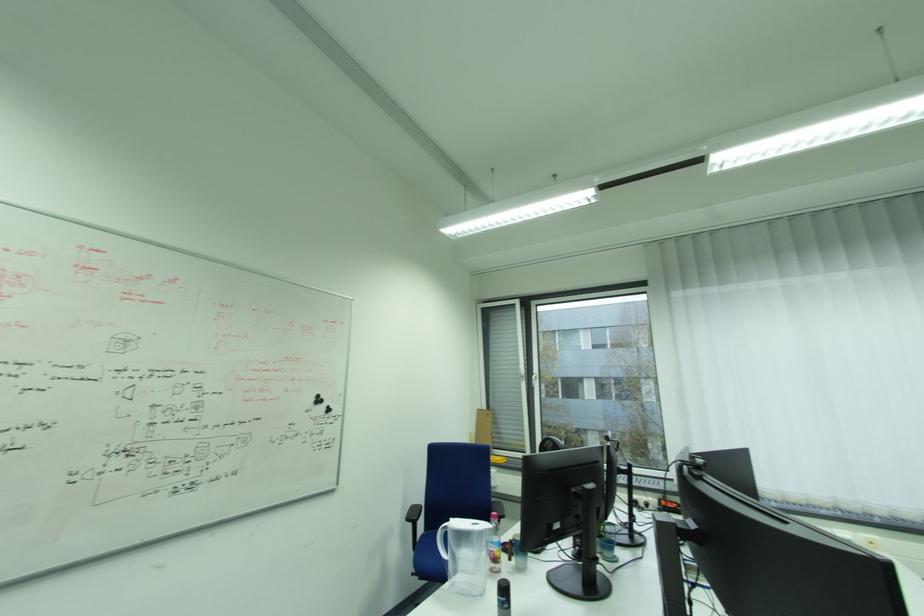
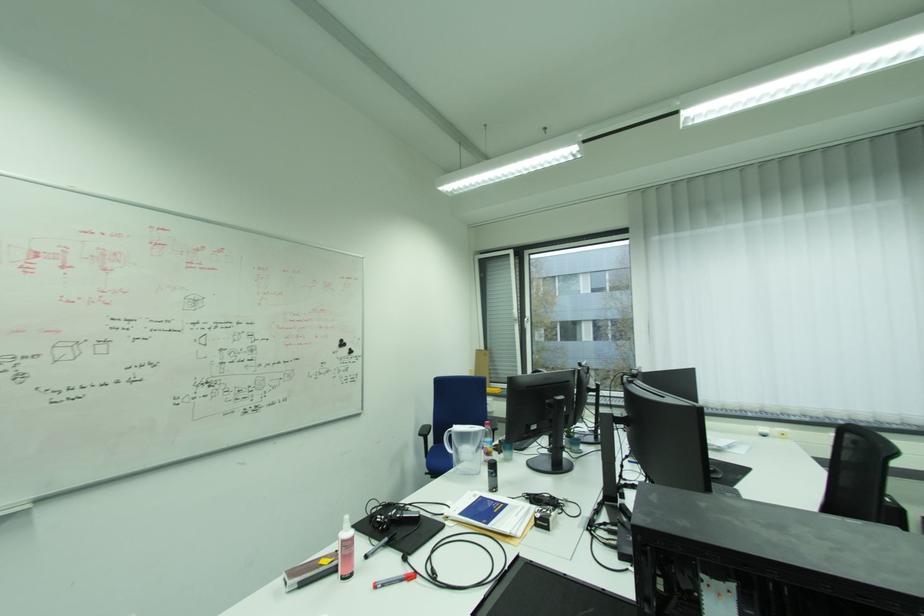
Question: What movement of the cameraman would produce the second image?

Choices:
 (A) Left
 (B) Right
 (C) Forward
 (D) Backward

Answer: (D)